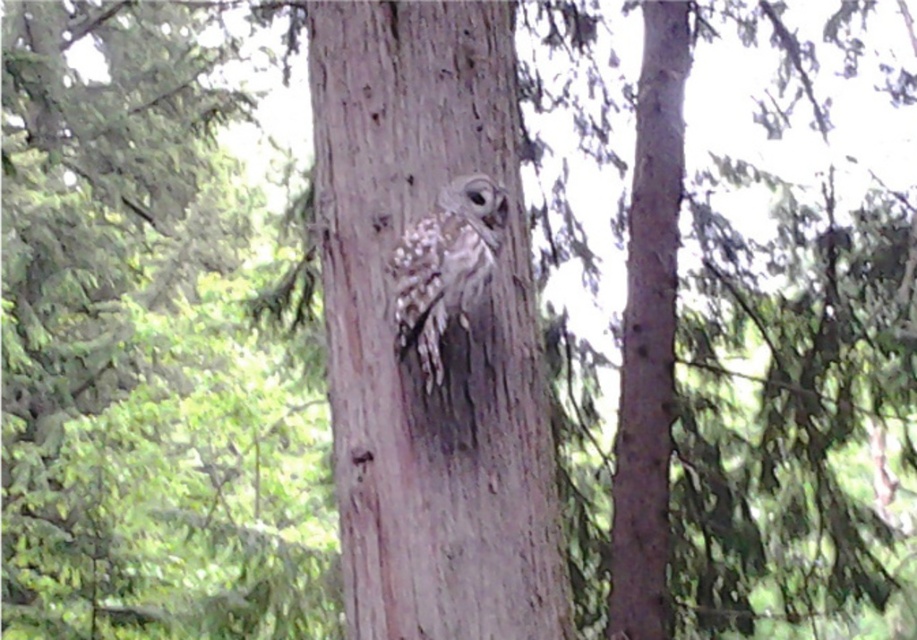
Can you confirm if smooth brown tree trunk at center is thinner than speckled feathered owl at center?

No, smooth brown tree trunk at center is not thinner than speckled feathered owl at center.

Locate an element on the screen. This screenshot has width=917, height=640. smooth brown tree trunk at center is located at coordinates (445, 337).

Is smooth bark tree trunk at center to the left of speckled feathered owl at center from the viewer's perspective?

In fact, smooth bark tree trunk at center is to the right of speckled feathered owl at center.

Is smooth bark tree trunk at center positioned in front of speckled feathered owl at center?

No, it is behind speckled feathered owl at center.

Who is more distant from viewer, (x=644, y=67) or (x=474, y=273)?

Point (x=644, y=67)

Identify the location of smooth bark tree trunk at center. The width and height of the screenshot is (917, 640). (649, 332).

Which of these two, smooth brown tree trunk at center or smooth bark tree trunk at center, stands taller?

With more height is smooth bark tree trunk at center.

Is point (429, 509) closer to viewer compared to point (653, 29)?

That is True.

Is point (512, 164) in front of point (645, 156)?

Yes, point (512, 164) is in front of point (645, 156).

Locate an element on the screen. Image resolution: width=917 pixels, height=640 pixels. smooth brown tree trunk at center is located at coordinates (445, 337).